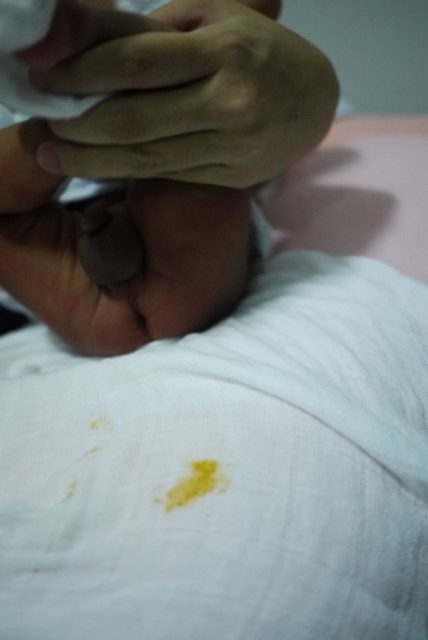
Is smooth skin hand at upper center positioned before smooth skin hand at center?

That is True.

Is point (139, 138) farther from camera compared to point (65, 298)?

No, (139, 138) is in front of (65, 298).

Identify the location of smooth skin hand at upper center. The image size is (428, 640). (187, 96).

Where is `smooth skin hand at upper center`? smooth skin hand at upper center is located at coordinates (187, 96).